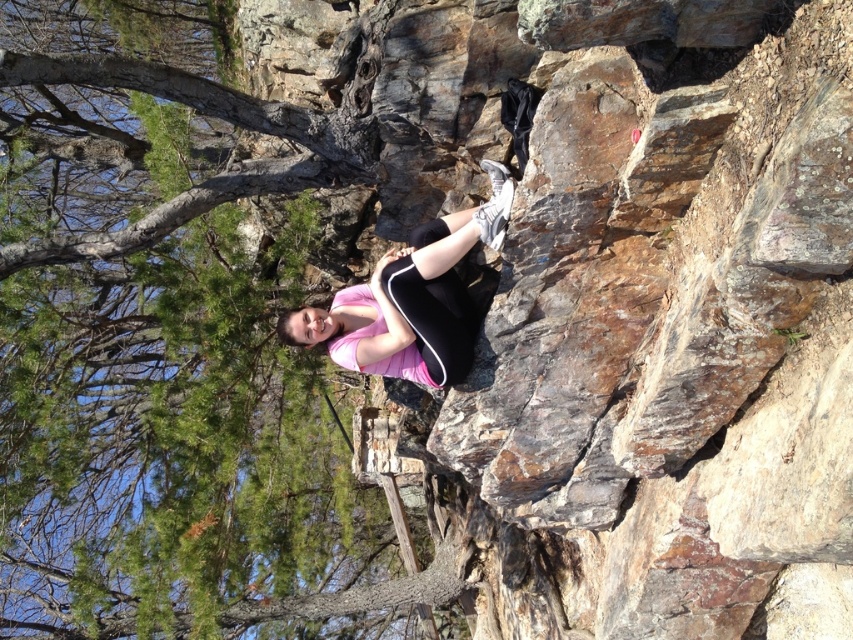
You are a photographer trying to capture the pink matte leggings at center in your shot. However, the rusty stone cliff at center is blocking your view. Can you move the cliff to get a clear shot of the leggings?

The rusty stone cliff at center is in front of the pink matte leggings at center, so you cannot move the cliff as it is part of the natural landscape. To capture the leggings, you may need to adjust your position or angle to avoid the cliff blocking the view.

Where is the rusty stone cliff at center located in the image?

The rusty stone cliff at center is located at point (640, 330) in the image.